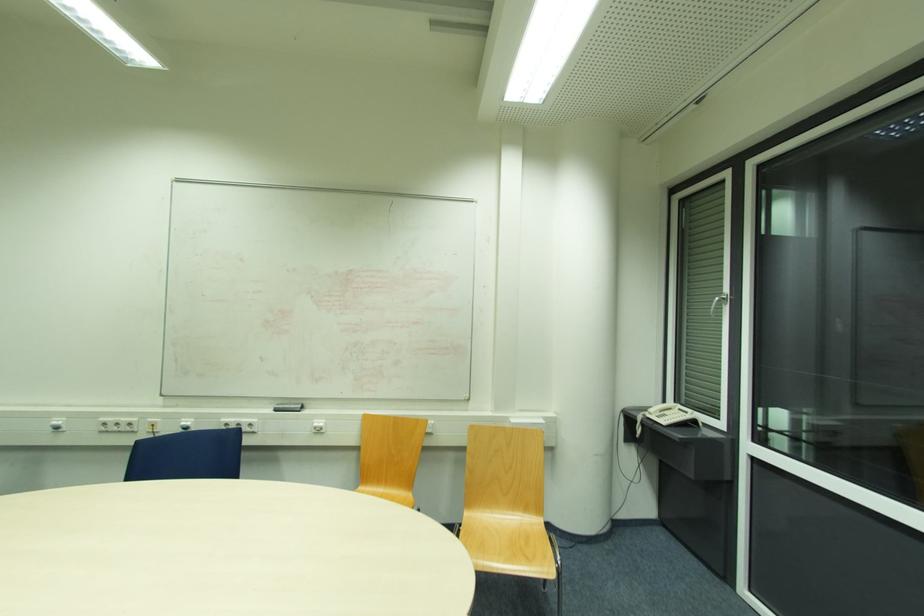
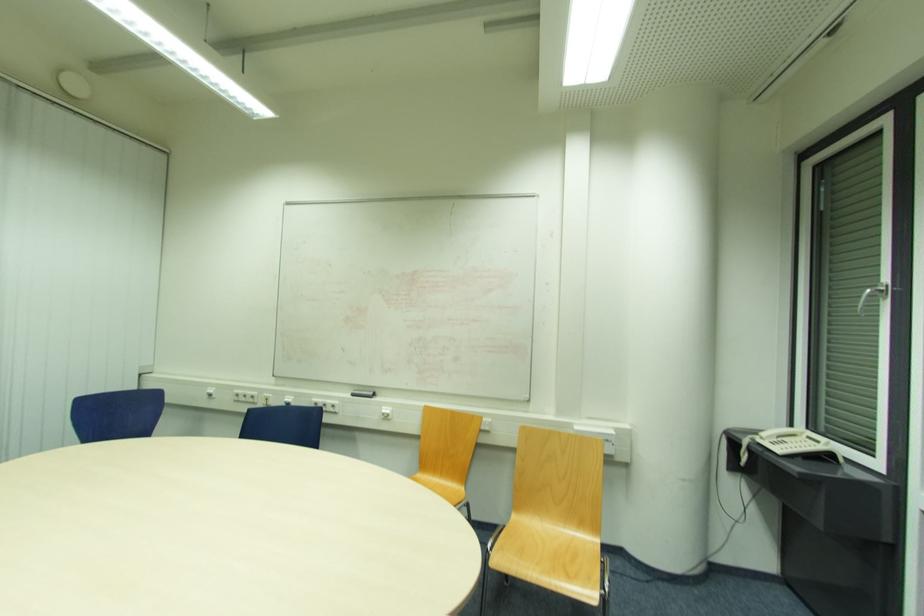
In the second image, find the point that corresponds to (410,496) in the first image.

(459, 490)